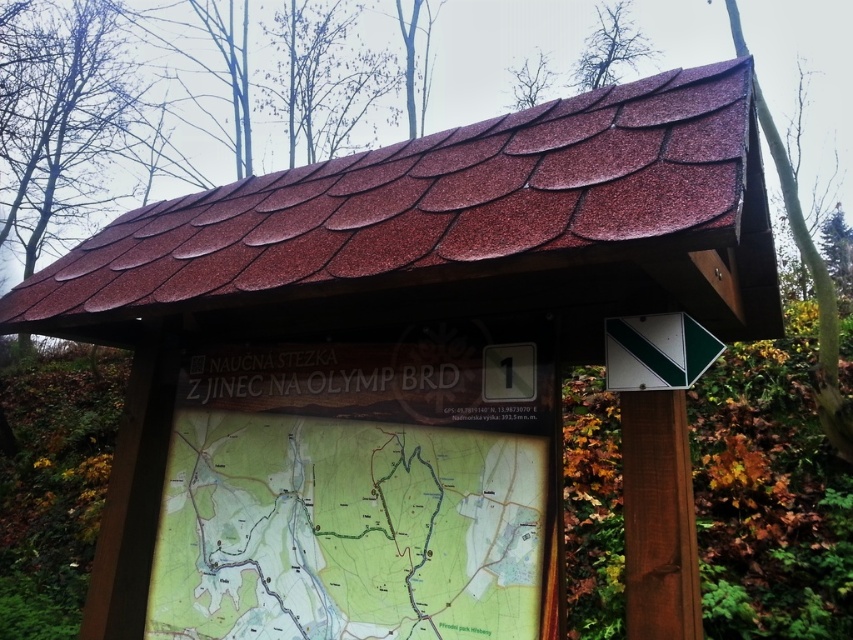
You are a hiker trying to determine the best path to take. You see two points marked on the map on the wooden signboard. The first point is at coordinate point (187,612) and the second is at point (627,371). Which point is closer to the camera of the signboard?

Point (627,371) is closer to the camera of the signboard because point (187,612) is further away from the camera than point (627,371).

You are a hiker who just arrived at the signboard and want to read both the green matte map at center and the green plastic sign at upper right. Which one will you need to look at first to get a better view?

You should look at the green matte map at center first because it is closer to you than the green plastic sign at upper right, so it will be easier to see clearly.

What is the spatial relationship between the green matte map at center and the green plastic sign at upper right?

The green matte map at center is to the left of the green plastic sign at upper right.